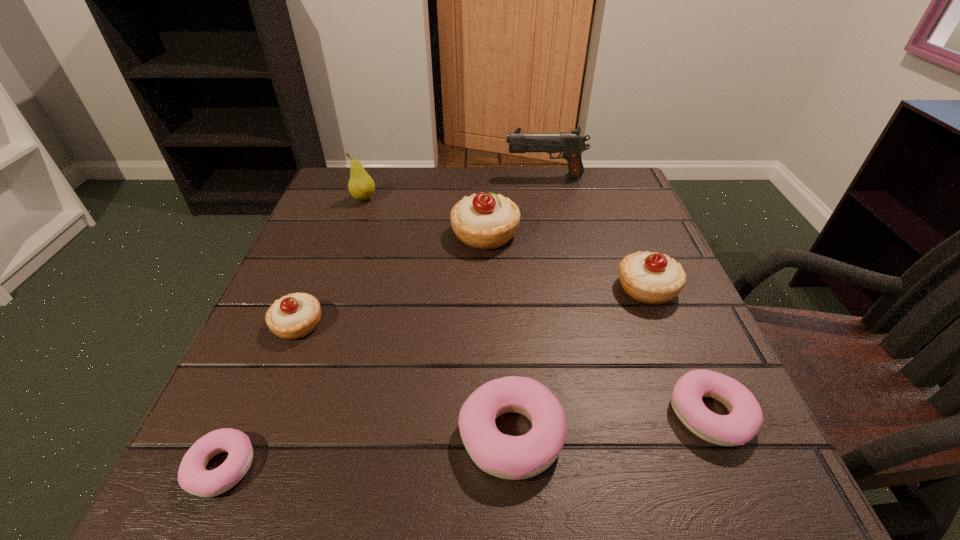
In order to click on blank space that satisfies the following two spatial constraints: 1. on the front side of the fourth shortest pastry; 2. on the left side of the second smallest pink pastry in this screenshot , I will do `click(261, 415)`.